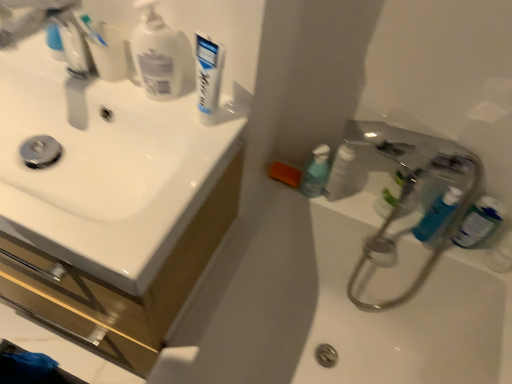
Question: Does white matte pump bottle at upper left lie behind white glossy toothpaste at upper center?

Choices:
 (A) yes
 (B) no

Answer: (A)

Question: Is white matte pump bottle at upper left smaller than white glossy toothpaste at upper center?

Choices:
 (A) yes
 (B) no

Answer: (B)

Question: Are white matte pump bottle at upper left and white glossy toothpaste at upper center making contact?

Choices:
 (A) yes
 (B) no

Answer: (A)

Question: From the image's perspective, is white matte pump bottle at upper left above white glossy toothpaste at upper center?

Choices:
 (A) yes
 (B) no

Answer: (A)

Question: Is white matte pump bottle at upper left thinner than white glossy toothpaste at upper center?

Choices:
 (A) no
 (B) yes

Answer: (A)

Question: Is the position of white matte pump bottle at upper left less distant than that of white glossy toothpaste at upper center?

Choices:
 (A) yes
 (B) no

Answer: (B)

Question: Is white glossy bath at lower right with green translucent bottle at upper right, the second mouthwash positioned from the left?

Choices:
 (A) no
 (B) yes

Answer: (A)

Question: Is the depth of white glossy bath at lower right less than that of green translucent bottle at upper right, the second mouthwash positioned from the left?

Choices:
 (A) no
 (B) yes

Answer: (B)

Question: Would you consider white glossy bath at lower right to be distant from green translucent bottle at upper right, the second mouthwash positioned from the left?

Choices:
 (A) no
 (B) yes

Answer: (A)

Question: Does white glossy bath at lower right have a greater height compared to green translucent bottle at upper right, placed as the 2th mouthwash when sorted from right to left?

Choices:
 (A) yes
 (B) no

Answer: (A)

Question: Does white glossy bath at lower right lie behind green translucent bottle at upper right, the second mouthwash positioned from the left?

Choices:
 (A) yes
 (B) no

Answer: (B)

Question: Is green translucent bottle at upper right, placed as the 2th mouthwash when sorted from right to left, at the back of white glossy bath at lower right?

Choices:
 (A) yes
 (B) no

Answer: (B)

Question: From the image's perspective, is blue plastic mouthwash at right, marked as the third mouthwash in a left-to-right arrangement, beneath white glossy sink at upper left?

Choices:
 (A) yes
 (B) no

Answer: (B)